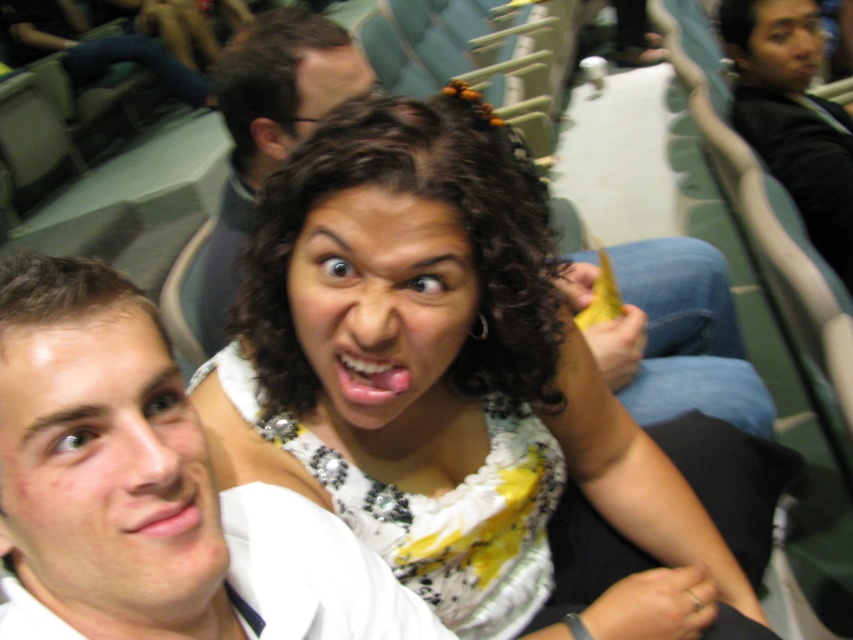
Where is `white shirt at center`? The height and width of the screenshot is (640, 853). white shirt at center is located at coordinates point(149,490).

Does white shirt at center come in front of smooth skin face at left?

Yes, white shirt at center is closer to the viewer.

Describe the element at coordinates (149, 490) in the screenshot. The width and height of the screenshot is (853, 640). I see `white shirt at center` at that location.

At what (x,y) coordinates should I click in order to perform the action: click on white shirt at center. Please return your answer as a coordinate pair (x, y). Looking at the image, I should click on (149, 490).

Can you confirm if white shirt at center is taller than black sweater at upper right?

No, white shirt at center is not taller than black sweater at upper right.

Is point (71, 321) farther from camera compared to point (741, 4)?

No, it is not.

Where is `white shirt at center`? This screenshot has height=640, width=853. white shirt at center is located at coordinates (149, 490).

You are a GUI agent. You are given a task and a screenshot of the screen. Output one action in this format:
    pyautogui.click(x=<x>, y=<y>)
    Task: Click on the white shirt at center
    This screenshot has height=640, width=853.
    Given the screenshot: What is the action you would take?
    pyautogui.click(x=149, y=490)

Who is positioned more to the right, smooth skin face at left or matte white blouse at center?

Positioned to the right is matte white blouse at center.

Can you confirm if smooth skin face at left is thinner than matte white blouse at center?

Indeed, smooth skin face at left has a lesser width compared to matte white blouse at center.

Which is in front, point (157, 524) or point (431, 355)?

Point (157, 524)

Where is `smooth skin face at left`? The height and width of the screenshot is (640, 853). smooth skin face at left is located at coordinates (105, 472).